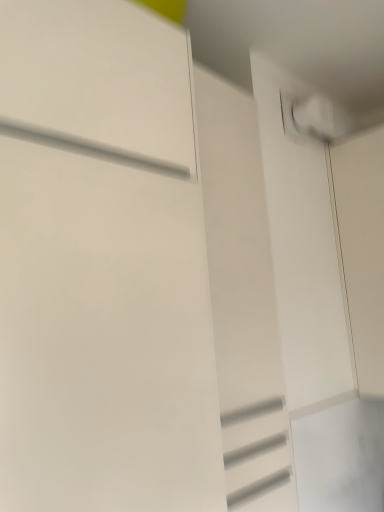
What is the approximate height of white matte door at center?

It is 4.35 feet.

What do you see at coordinates (243, 301) in the screenshot?
I see `white matte door at center` at bounding box center [243, 301].

The height and width of the screenshot is (512, 384). I want to click on white matte door at center, so click(243, 301).

Locate an element on the screen. white matte door at center is located at coordinates (243, 301).